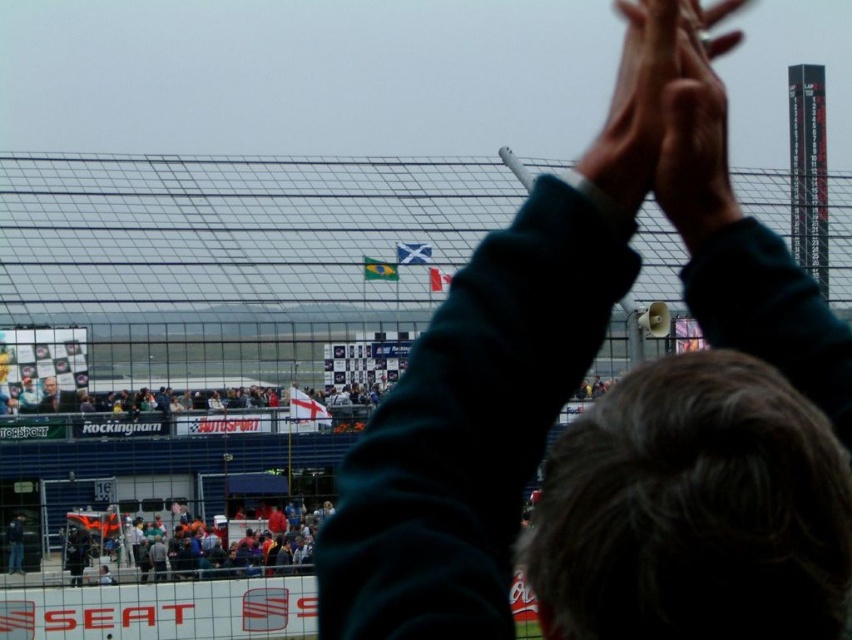
Question: Which point is farther from the camera taking this photo?

Choices:
 (A) (642, 172)
 (B) (421, 468)
 (C) (248, 566)
 (D) (56, 406)

Answer: (D)

Question: Is smooth skin hands at upper center wider than smooth skin face at upper left?

Choices:
 (A) no
 (B) yes

Answer: (B)

Question: Which of these objects is positioned farthest from the multicolored fabric crowd at lower center?

Choices:
 (A) dark green sweater at upper center
 (B) smooth skin face at upper left

Answer: (A)

Question: Which of the following is the farthest from the observer?

Choices:
 (A) (649, 72)
 (B) (110, 570)
 (C) (585, 468)
 (D) (65, 403)

Answer: (D)

Question: Can you confirm if dark green sweater at upper center is wider than multicolored fabric crowd at lower center?

Choices:
 (A) no
 (B) yes

Answer: (B)

Question: Does smooth skin hands at upper center appear over smooth skin face at upper left?

Choices:
 (A) yes
 (B) no

Answer: (A)